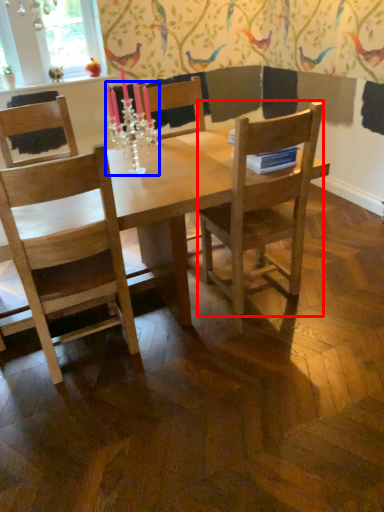
Question: Which object appears closest to the camera in this image, chair (highlighted by a red box) or candle holder (highlighted by a blue box)?

Choices:
 (A) chair
 (B) candle holder

Answer: (A)